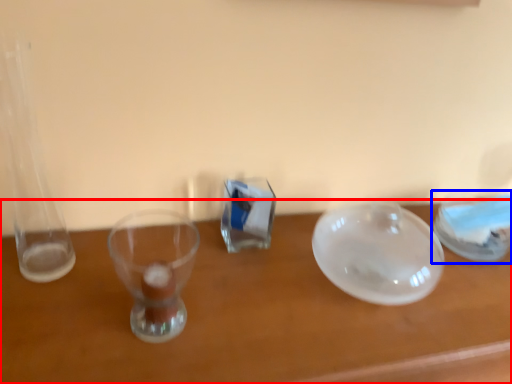
Question: Among these objects, which one is farthest to the camera, table (highlighted by a red box) or tableware (highlighted by a blue box)?

Choices:
 (A) table
 (B) tableware

Answer: (B)